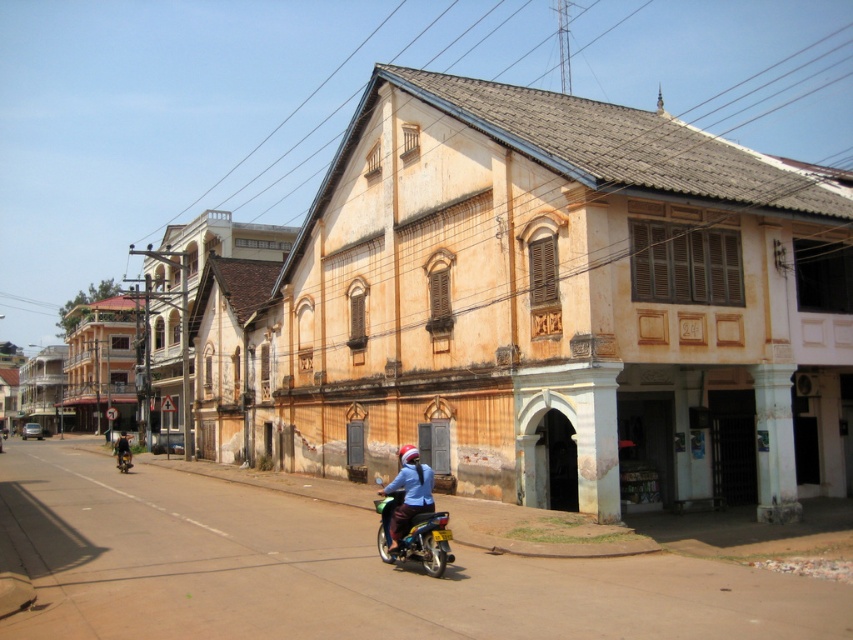
Looking at this image, can you confirm if blue fabric santa hat at center is taller than dark blue fabric jacket at left?

No.

Who is more forward, (422, 504) or (119, 436)?

Point (422, 504) is more forward.

Does point (412, 468) come closer to viewer compared to point (131, 465)?

That is True.

This screenshot has width=853, height=640. What are the coordinates of `blue fabric santa hat at center` in the screenshot? It's located at (408, 493).

Does beige textured building at center have a greater height compared to blue fabric santa hat at center?

Yes, beige textured building at center is taller than blue fabric santa hat at center.

Is beige textured building at center wider than blue fabric santa hat at center?

Yes.

The image size is (853, 640). What do you see at coordinates (538, 308) in the screenshot?
I see `beige textured building at center` at bounding box center [538, 308].

I want to click on beige textured building at center, so click(538, 308).

Is point (730, 193) closer to viewer compared to point (119, 444)?

Yes, it is in front of point (119, 444).

Locate an element on the screen. Image resolution: width=853 pixels, height=640 pixels. beige textured building at center is located at coordinates (538, 308).